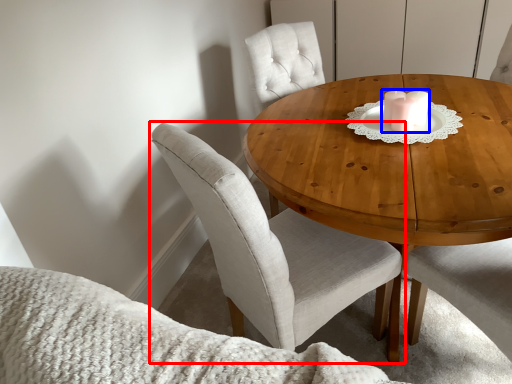
Question: Which of the following is the farthest to the observer, chair (highlighted by a red box) or candle holder (highlighted by a blue box)?

Choices:
 (A) chair
 (B) candle holder

Answer: (B)